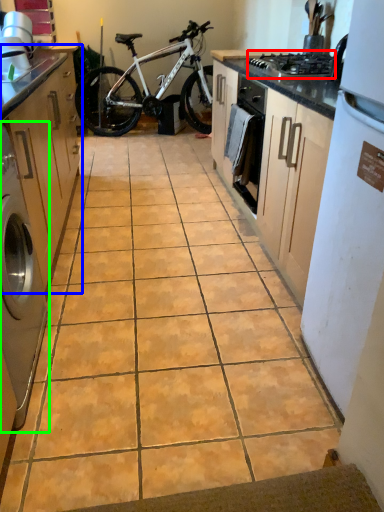
Question: Which object is positioned closest to gas stove (highlighted by a red box)? Select from cabinetry (highlighted by a blue box) and home appliance (highlighted by a green box).

Choices:
 (A) cabinetry
 (B) home appliance

Answer: (A)